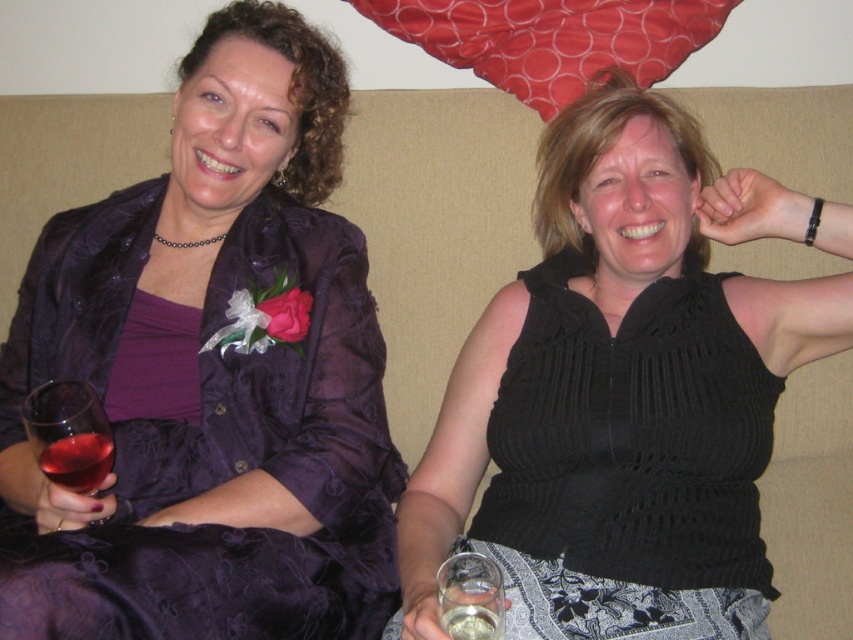
Question: Based on their relative distances, which object is nearer to the black knitted top at center?

Choices:
 (A) clear glass wine at center
 (B) translucent glass wine glass at left
 (C) matte purple dress at center

Answer: (C)

Question: Can you confirm if translucent glass wine glass at left is wider than translucent glass at lower left?

Choices:
 (A) yes
 (B) no

Answer: (A)

Question: Among these points, which one is farthest from the camera?

Choices:
 (A) (229, 74)
 (B) (485, 589)
 (C) (35, 449)

Answer: (A)

Question: From the image, what is the correct spatial relationship of matte purple dress at center in relation to black knitted top at center?

Choices:
 (A) right
 (B) left

Answer: (B)

Question: Does translucent glass wine glass at left have a larger size compared to translucent glass at lower left?

Choices:
 (A) no
 (B) yes

Answer: (B)

Question: Which is nearer to the black knitted top at center?

Choices:
 (A) translucent glass at lower left
 (B) translucent glass wine glass at left
 (C) matte purple dress at center

Answer: (C)